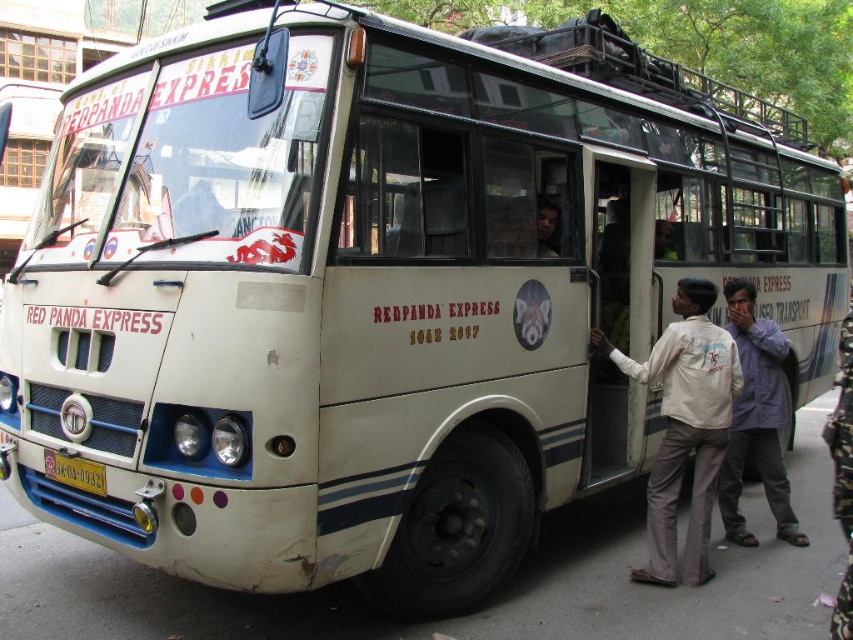
What is the relationship between the width of the light purple shirt at center and the yellow matte license plate at lower center in the image?

The light purple shirt at center might be wider than yellow matte license plate at lower center according to the description.

You are a fashion designer observing two shirts in an urban scene. The scene includes a vintage bus with the name RED PANDA EXPRESS. You see a white cotton shirt at right and a light purple shirt at center. Which shirt is shorter in height?

The white cotton shirt at right has a lesser height compared to the light purple shirt at center, so the white cotton shirt at right is shorter in height.